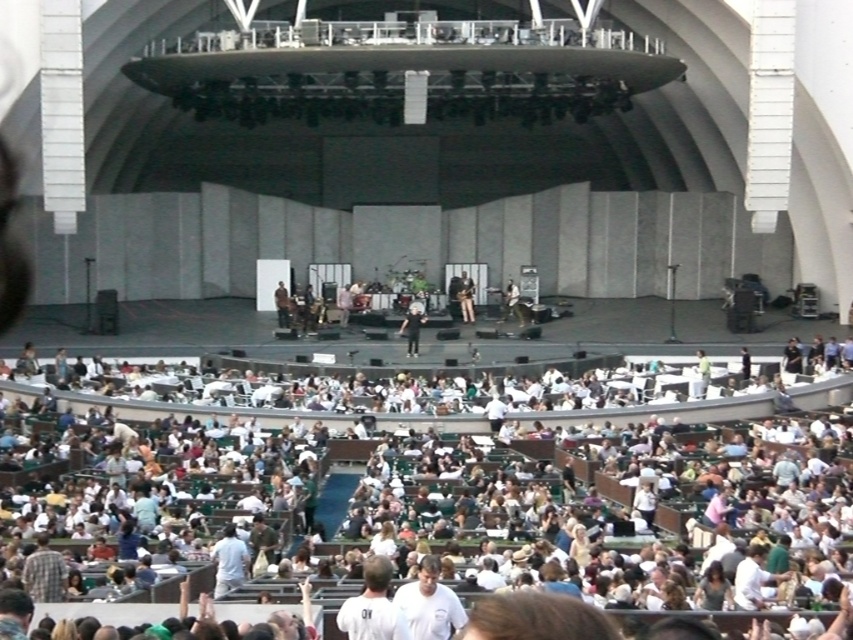
Which is more to the left, black fabric shirt at center or white shirt at center?

black fabric shirt at center is more to the left.

Is black fabric shirt at center smaller than white shirt at center?

No.

Which is behind, point (407, 342) or point (509, 284)?

The point (509, 284) is more distant.

Where is `black fabric shirt at center`? black fabric shirt at center is located at coordinates (412, 326).

Can you confirm if white fabric seats at lower center is bigger than dark brown leather jacket at center?

Yes, white fabric seats at lower center is bigger than dark brown leather jacket at center.

Does white fabric seats at lower center appear on the right side of dark brown leather jacket at center?

Yes, white fabric seats at lower center is to the right of dark brown leather jacket at center.

Is point (235, 481) positioned after point (283, 289)?

That is False.

Where is `white fabric seats at lower center`? white fabric seats at lower center is located at coordinates coord(469,509).

Is point (506, 554) more distant than point (412, 304)?

No.

Between point (309, 449) and point (415, 332), which one is positioned behind?

Positioned behind is point (415, 332).

In order to click on white fabric seats at lower center in this screenshot , I will do `click(469, 509)`.